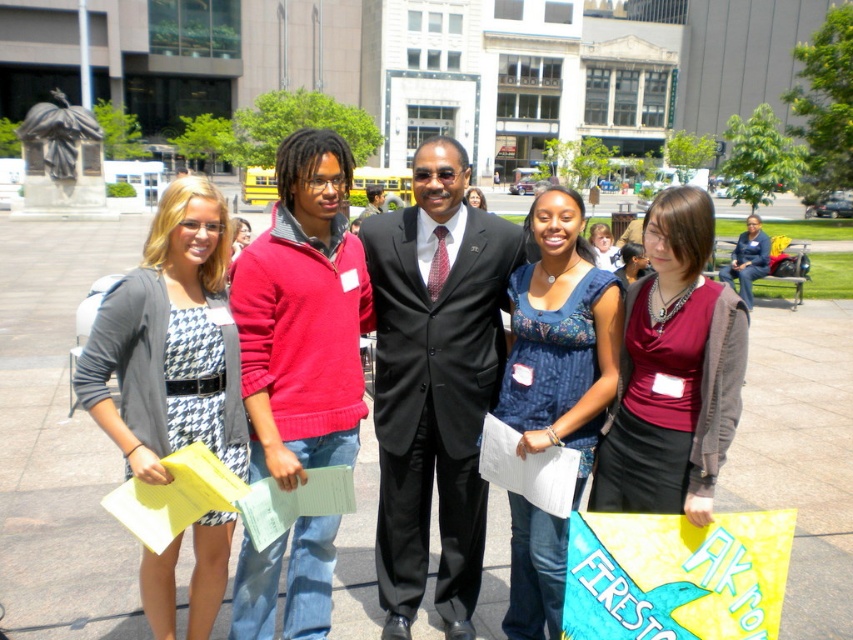
Question: Is maroon jersey at center above matte black dress at center?

Choices:
 (A) yes
 (B) no

Answer: (B)

Question: Is blue dotted blouse at center below matte black dress at center?

Choices:
 (A) no
 (B) yes

Answer: (B)

Question: Is blue dotted blouse at center further to the viewer compared to houndstooth dress at center?

Choices:
 (A) yes
 (B) no

Answer: (B)

Question: Which point appears closest to the camera in this image?

Choices:
 (A) (602, 456)
 (B) (238, 218)

Answer: (A)

Question: Which of the following is the farthest from the observer?

Choices:
 (A) matte black dress at center
 (B) black suit at center
 (C) dark suit at center
 (D) houndstooth dress at center

Answer: (C)

Question: Which object is positioned closest to the houndstooth fabric dress at left?

Choices:
 (A) houndstooth dress at center
 (B) blue dotted blouse at center

Answer: (A)